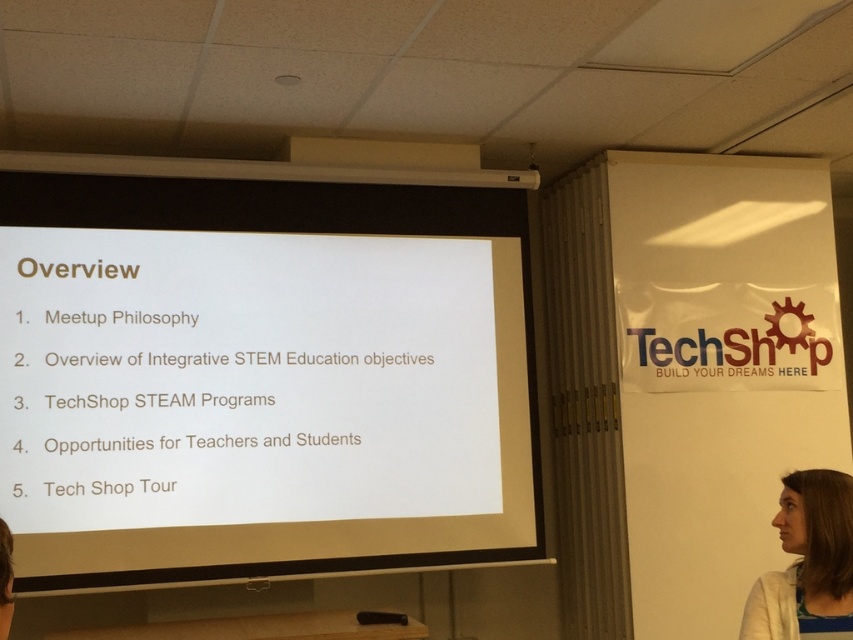
You are a presenter standing at the front of the room. You need to hand out a document to a participant who is wearing the white knitwear at lower right. The document is on the white paper at center. Can you reach them without moving from your position?

The white paper at center is 5.94 feet away from the white knitwear at lower right. Since the presenter is at the front, they would need to extend their arm or use a pointer to reach 5.94 feet, which is approximately 6 feet. A typical arm reach is about 2.5 to 3 feet, so the presenter cannot reach them without moving.

You are an attendee at the presentation. You see the white paper at center and the white knitwear at lower right. Which object is closer to you?

The white paper at center is closer to you because the white knitwear at lower right is behind it.